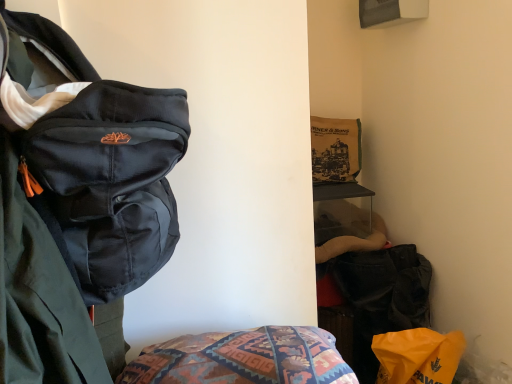
Question: Is matte black backpack at left placed right next to velvet black bag at lower right?

Choices:
 (A) yes
 (B) no

Answer: (B)

Question: From the image's perspective, would you say matte black backpack at left is shown under velvet black bag at lower right?

Choices:
 (A) yes
 (B) no

Answer: (B)

Question: From the image's perspective, would you say matte black backpack at left is positioned over velvet black bag at lower right?

Choices:
 (A) yes
 (B) no

Answer: (A)

Question: Can you confirm if matte black backpack at left is positioned to the left of velvet black bag at lower right?

Choices:
 (A) yes
 (B) no

Answer: (A)

Question: Could you tell me if matte black backpack at left is turned towards velvet black bag at lower right?

Choices:
 (A) no
 (B) yes

Answer: (A)

Question: Based on their positions, is velvet black bag at lower right located to the left or right of matte black backpack at left?

Choices:
 (A) right
 (B) left

Answer: (A)

Question: Do you think velvet black bag at lower right is within matte black backpack at left, or outside of it?

Choices:
 (A) inside
 (B) outside

Answer: (B)

Question: From their relative heights in the image, would you say velvet black bag at lower right is taller or shorter than matte black backpack at left?

Choices:
 (A) tall
 (B) short

Answer: (B)

Question: In terms of size, does velvet black bag at lower right appear bigger or smaller than matte black backpack at left?

Choices:
 (A) small
 (B) big

Answer: (A)

Question: From the image's perspective, is matte black backpack at left positioned above or below orange plastic bag at lower right?

Choices:
 (A) below
 (B) above

Answer: (B)

Question: Is matte black backpack at left situated inside orange plastic bag at lower right or outside?

Choices:
 (A) inside
 (B) outside

Answer: (B)

Question: Is matte black backpack at left in front of or behind orange plastic bag at lower right in the image?

Choices:
 (A) behind
 (B) front

Answer: (B)

Question: From their relative heights in the image, would you say matte black backpack at left is taller or shorter than orange plastic bag at lower right?

Choices:
 (A) tall
 (B) short

Answer: (A)

Question: From the image's perspective, is matte black backpack at left located above or below velvet black bag at lower right?

Choices:
 (A) below
 (B) above

Answer: (B)

Question: Is matte black backpack at left taller or shorter than velvet black bag at lower right?

Choices:
 (A) short
 (B) tall

Answer: (B)